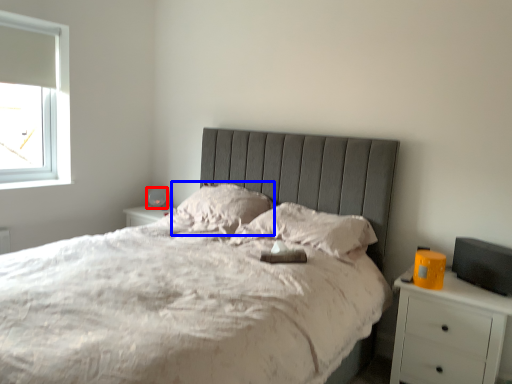
Question: Which object is further to the camera taking this photo, table lamp (highlighted by a red box) or pillow (highlighted by a blue box)?

Choices:
 (A) table lamp
 (B) pillow

Answer: (A)